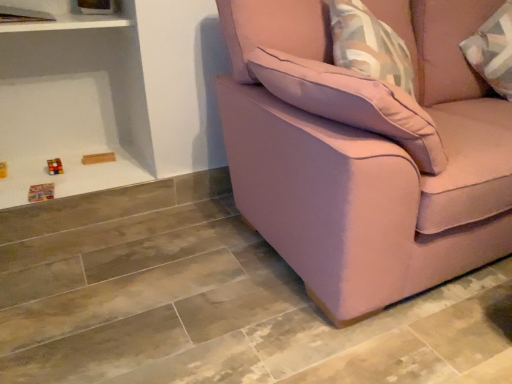
Question: Can you confirm if pink fabric couch at right is positioned to the left of white glossy shelf at upper left?

Choices:
 (A) yes
 (B) no

Answer: (B)

Question: Does pink fabric couch at right have a larger size compared to white glossy shelf at upper left?

Choices:
 (A) no
 (B) yes

Answer: (B)

Question: Is pink fabric couch at right in front of white glossy shelf at upper left?

Choices:
 (A) yes
 (B) no

Answer: (A)

Question: From the image's perspective, would you say pink fabric couch at right is positioned over white glossy shelf at upper left?

Choices:
 (A) yes
 (B) no

Answer: (B)

Question: From a real-world perspective, is pink fabric couch at right beneath white glossy shelf at upper left?

Choices:
 (A) no
 (B) yes

Answer: (B)

Question: From a real-world perspective, is pink fabric couch at right on white glossy shelf at upper left?

Choices:
 (A) yes
 (B) no

Answer: (B)

Question: Is white glossy shelf at upper left far from pink fabric couch at right?

Choices:
 (A) yes
 (B) no

Answer: (A)

Question: Can you confirm if white glossy shelf at upper left is bigger than pink fabric couch at right?

Choices:
 (A) no
 (B) yes

Answer: (A)

Question: Is pink fabric couch at right at the back of white glossy shelf at upper left?

Choices:
 (A) no
 (B) yes

Answer: (A)

Question: Considering the relative sizes of white glossy shelf at upper left and pink fabric couch at right in the image provided, is white glossy shelf at upper left thinner than pink fabric couch at right?

Choices:
 (A) no
 (B) yes

Answer: (B)

Question: Would you say white glossy shelf at upper left contains pink fabric couch at right?

Choices:
 (A) yes
 (B) no

Answer: (B)

Question: Does white glossy shelf at upper left have a greater height compared to pink fabric couch at right?

Choices:
 (A) yes
 (B) no

Answer: (B)

Question: Is pink fabric pillow at upper right shorter than pink fabric couch at right?

Choices:
 (A) no
 (B) yes

Answer: (B)